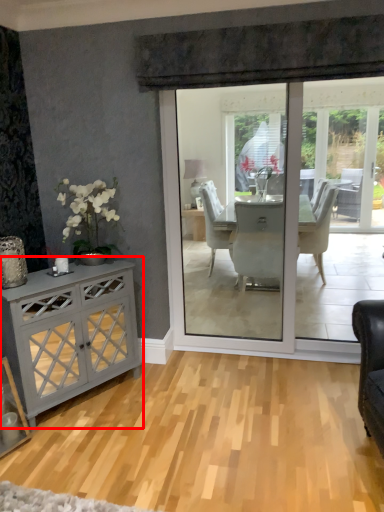
Question: From the image's perspective, what is the correct spatial relationship of cabinetry (annotated by the red box) in relation to plain?

Choices:
 (A) below
 (B) above

Answer: (B)